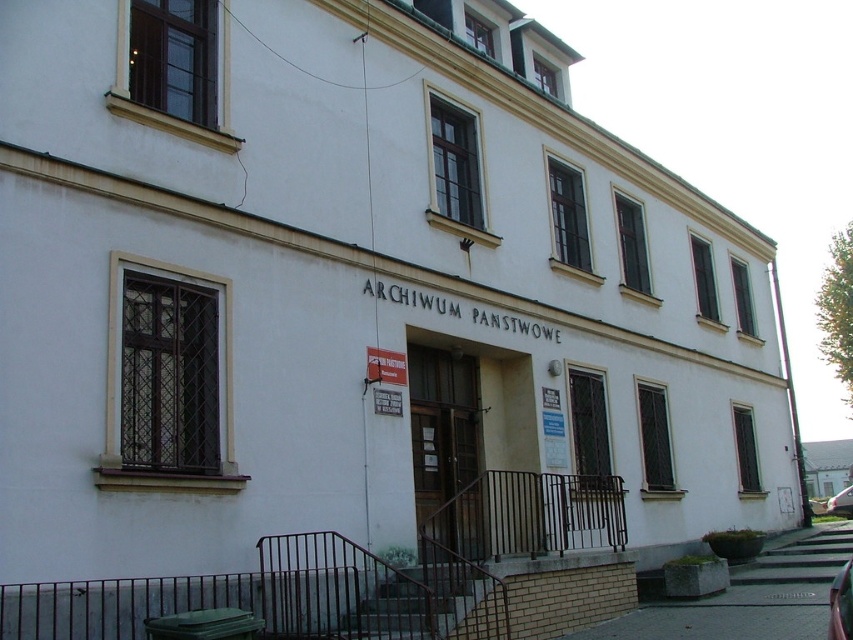
Can you confirm if shiny red car at center is smaller than metallic silver car at lower right?

Yes.

The image size is (853, 640). I want to click on shiny red car at center, so click(840, 604).